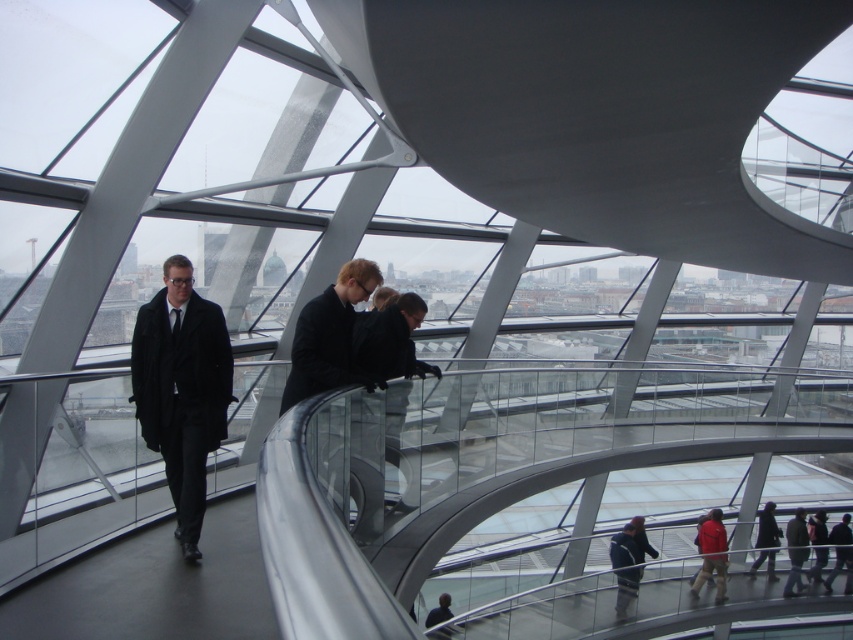
Who is lower down, black matte suit at center or matte black jacket at lower right?

Positioned lower is matte black jacket at lower right.

Identify the location of black matte suit at center. point(321,348).

Locate an element on the screen. black matte suit at center is located at coordinates (321, 348).

Is point (221, 390) behind point (312, 346)?

That is False.

Identify the location of matte black coat at left. The image size is (853, 640). (181, 388).

Between point (138, 323) and point (341, 310), which one is positioned in front?

Point (138, 323) is more forward.

What are the coordinates of `matte black coat at left` in the screenshot? It's located at (181, 388).

Between matte black coat at left and matte black jacket at lower right, which one has less height?

With less height is matte black jacket at lower right.

Who is higher up, matte black coat at left or matte black jacket at lower right?

matte black coat at left is higher up.

Does point (183, 484) come closer to viewer compared to point (805, 572)?

That is True.

Identify the location of matte black coat at left. (181, 388).